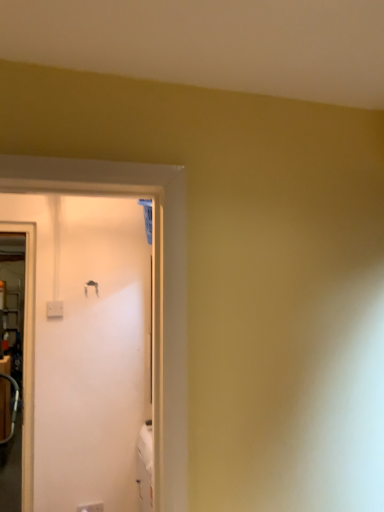
At what (x,y) coordinates should I click in order to perform the action: click on white plastic electric outlet at lower left. Please return your answer as a coordinate pair (x, y). The width and height of the screenshot is (384, 512). Looking at the image, I should click on (91, 507).

What do you see at coordinates (91, 507) in the screenshot?
I see `white plastic electric outlet at lower left` at bounding box center [91, 507].

The width and height of the screenshot is (384, 512). In order to click on metallic silver door handle at upper left in this screenshot , I will do `click(91, 286)`.

Describe the element at coordinates (91, 286) in the screenshot. This screenshot has width=384, height=512. I see `metallic silver door handle at upper left` at that location.

At what (x,y) coordinates should I click in order to perform the action: click on white plastic electric outlet at lower left. Please return your answer as a coordinate pair (x, y). The image size is (384, 512). Looking at the image, I should click on (91, 507).

Between metallic silver door handle at upper left and white plastic electric outlet at lower left, which one appears on the left side from the viewer's perspective?

metallic silver door handle at upper left is more to the left.

Is metallic silver door handle at upper left closer to the viewer compared to white plastic electric outlet at lower left?

No, metallic silver door handle at upper left is behind white plastic electric outlet at lower left.

Is point (89, 285) positioned before point (103, 503)?

No, it is behind (103, 503).

From the image's perspective, which object appears higher, metallic silver door handle at upper left or white plastic electric outlet at lower left?

From the image's view, metallic silver door handle at upper left is above.

From a real-world perspective, which is physically below, metallic silver door handle at upper left or white plastic electric outlet at lower left?

white plastic electric outlet at lower left is physically lower.

Between metallic silver door handle at upper left and white plastic electric outlet at lower left, which one has larger width?

Wider between the two is white plastic electric outlet at lower left.

Is metallic silver door handle at upper left taller or shorter than white plastic electric outlet at lower left?

Clearly, metallic silver door handle at upper left is taller compared to white plastic electric outlet at lower left.

Considering the relative sizes of metallic silver door handle at upper left and white plastic electric outlet at lower left in the image provided, is metallic silver door handle at upper left smaller than white plastic electric outlet at lower left?

Yes, metallic silver door handle at upper left is smaller than white plastic electric outlet at lower left.

Is metallic silver door handle at upper left surrounding white plastic electric outlet at lower left?

No, metallic silver door handle at upper left does not contain white plastic electric outlet at lower left.

Is metallic silver door handle at upper left touching white plastic electric outlet at lower left?

No, metallic silver door handle at upper left is not with white plastic electric outlet at lower left.

Is metallic silver door handle at upper left positioned with its back to white plastic electric outlet at lower left?

metallic silver door handle at upper left does not have its back to white plastic electric outlet at lower left.

What's the angular difference between metallic silver door handle at upper left and white plastic electric outlet at lower left's facing directions?

The facing directions of metallic silver door handle at upper left and white plastic electric outlet at lower left are 4.79 degrees apart.

How much distance is there between metallic silver door handle at upper left and white plastic electric outlet at lower left?

metallic silver door handle at upper left is 4.05 feet away from white plastic electric outlet at lower left.

The width and height of the screenshot is (384, 512). Find the location of `door handle above the white plastic electric outlet at lower left (from the image's perspective)`. door handle above the white plastic electric outlet at lower left (from the image's perspective) is located at coordinates (91, 286).

Considering the positions of objects white plastic electric outlet at lower left and metallic silver door handle at upper left in the image provided, who is more to the left, white plastic electric outlet at lower left or metallic silver door handle at upper left?

metallic silver door handle at upper left.

Considering the relative positions of white plastic electric outlet at lower left and metallic silver door handle at upper left in the image provided, is white plastic electric outlet at lower left in front of metallic silver door handle at upper left?

Yes, white plastic electric outlet at lower left is in front of metallic silver door handle at upper left.

Is point (87, 510) in front of point (94, 287)?

Yes, point (87, 510) is closer to viewer.

From the image's perspective, which one is positioned higher, white plastic electric outlet at lower left or metallic silver door handle at upper left?

metallic silver door handle at upper left is shown above in the image.

From a real-world perspective, is white plastic electric outlet at lower left physically located above or below metallic silver door handle at upper left?

Clearly, from a real-world perspective, white plastic electric outlet at lower left is below metallic silver door handle at upper left.

Which of these two, white plastic electric outlet at lower left or metallic silver door handle at upper left, is thinner?

metallic silver door handle at upper left.

Between white plastic electric outlet at lower left and metallic silver door handle at upper left, which one has less height?

Standing shorter between the two is white plastic electric outlet at lower left.

Can you confirm if white plastic electric outlet at lower left is smaller than metallic silver door handle at upper left?

Actually, white plastic electric outlet at lower left might be larger than metallic silver door handle at upper left.

Is white plastic electric outlet at lower left not within metallic silver door handle at upper left?

Yes.

Does white plastic electric outlet at lower left touch metallic silver door handle at upper left?

They are not placed beside each other.

Is white plastic electric outlet at lower left aimed at metallic silver door handle at upper left?

No, white plastic electric outlet at lower left does not turn towards metallic silver door handle at upper left.

Can you tell me how much white plastic electric outlet at lower left and metallic silver door handle at upper left differ in facing direction?

They differ by 4.79 degrees in their facing directions.

You are a GUI agent. You are given a task and a screenshot of the screen. Output one action in this format:
    pyautogui.click(x=<x>, y=<y>)
    Task: Click on the electric outlet below the metallic silver door handle at upper left (from the image's perspective)
    
    Given the screenshot: What is the action you would take?
    pyautogui.click(x=91, y=507)

Locate an element on the screen. electric outlet that appears below the metallic silver door handle at upper left (from the image's perspective) is located at coordinates (91, 507).

You are a GUI agent. You are given a task and a screenshot of the screen. Output one action in this format:
    pyautogui.click(x=<x>, y=<y>)
    Task: Click on the door handle above the white plastic electric outlet at lower left (from a real-world perspective)
    
    Given the screenshot: What is the action you would take?
    pyautogui.click(x=91, y=286)